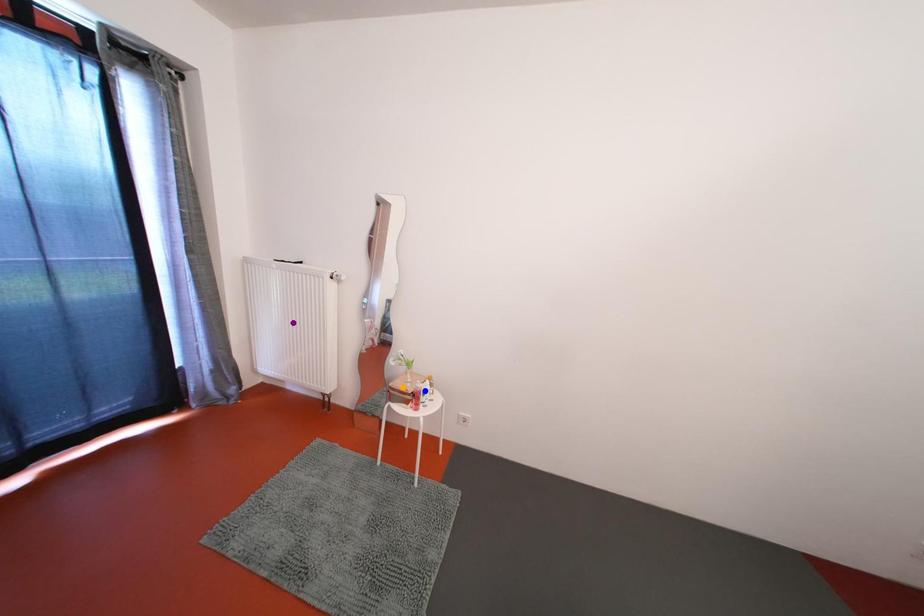
Order these from nearest to farthest:
blue point
purple point
orange point

orange point, blue point, purple point